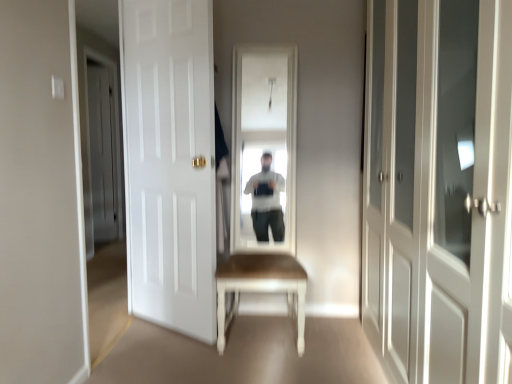
Where is `vacant area located to the right-hand side of light brown wooden table at center`? The image size is (512, 384). vacant area located to the right-hand side of light brown wooden table at center is located at coordinates (339, 336).